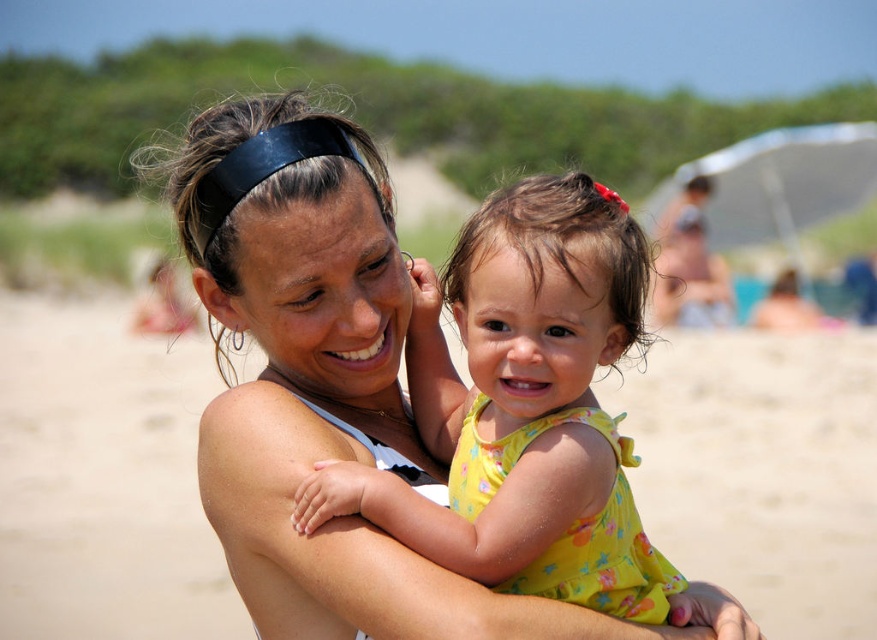
Question: Among these objects, which one is nearest to the camera?

Choices:
 (A) yellow floral dress at center
 (B) beige sand at center

Answer: (A)

Question: Which point is farther from the camera taking this photo?

Choices:
 (A) tap(783, 372)
 (B) tap(617, 356)

Answer: (A)

Question: Can you confirm if beige sand at center is positioned above yellow floral dress at center?

Choices:
 (A) yes
 (B) no

Answer: (A)

Question: Does beige sand at center appear over yellow floral dress at center?

Choices:
 (A) yes
 (B) no

Answer: (A)

Question: Does beige sand at center appear over yellow floral dress at center?

Choices:
 (A) yes
 (B) no

Answer: (A)